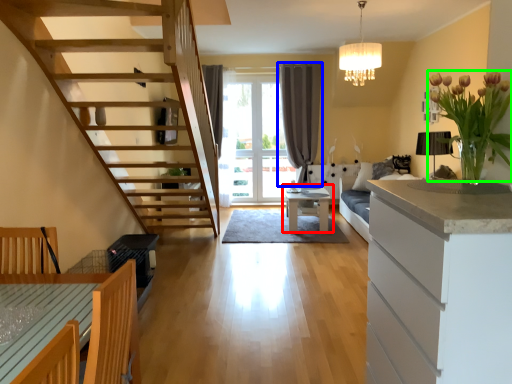
Question: Which object is positioned closest to table (highlighted by a red box)? Select from curtain (highlighted by a blue box) and flower (highlighted by a green box).

Choices:
 (A) curtain
 (B) flower

Answer: (A)